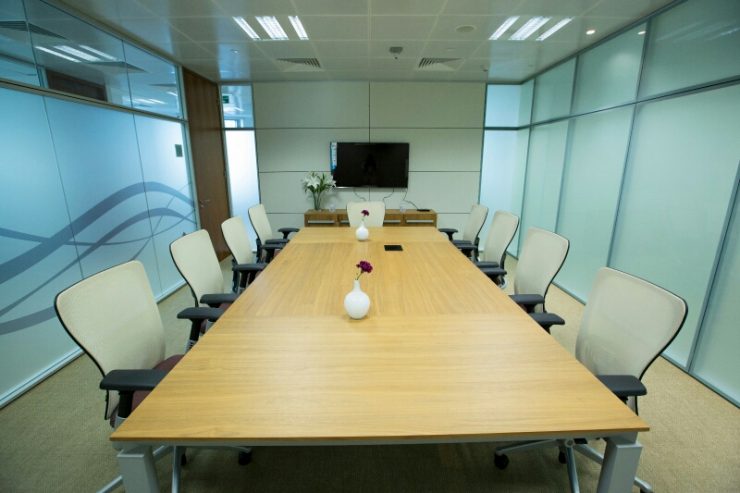
I want to click on chairs on left of table, so click(x=107, y=330), click(x=206, y=268), click(x=235, y=237), click(x=263, y=223).